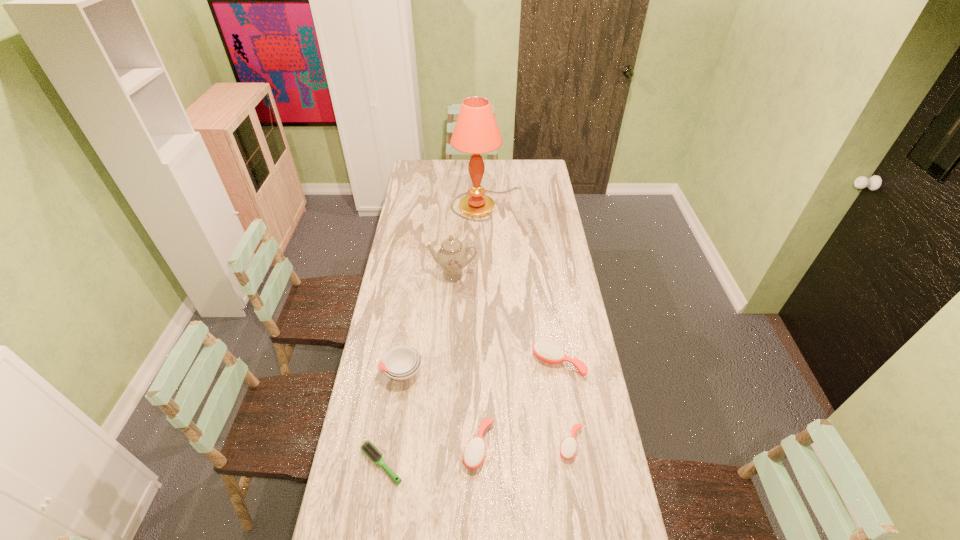
The image size is (960, 540). Find the location of `pink lamp`. pink lamp is located at coordinates (476, 132).

I want to click on the tallest object, so click(x=476, y=132).

Find the location of a particular element. the second farthest object is located at coordinates (452, 257).

Locate an element on the screen. The image size is (960, 540). the sixth shortest object is located at coordinates (452, 257).

Where is `soup bowl`? soup bowl is located at coordinates (401, 363).

The height and width of the screenshot is (540, 960). I want to click on the tallest hairbrush, so click(546, 350).

Find the location of a particular element. the farthest hairbrush is located at coordinates (546, 350).

This screenshot has width=960, height=540. Identify the location of the fifth tallest object. (474, 453).

This screenshot has width=960, height=540. What are the coordinates of `the second hairbrush from left to right` in the screenshot? It's located at (474, 453).

I want to click on the smallest orange hairbrush, so click(x=568, y=448).